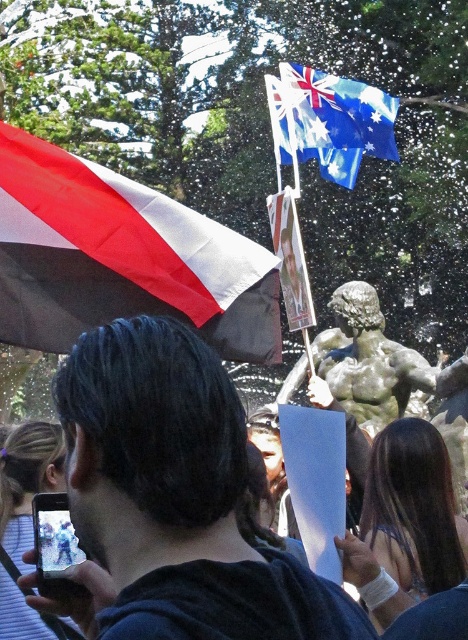
You are standing at the camera position and want to reach the point marked at coordinates (221, 252). If you walk straight ahead, will you reach that point before walking 50 meters?

Yes, because the point at (221, 252) is only 49.25 meters away from the camera, which is less than 50 meters.

You are at an event and want to take a photo of both the red and white striped flag at upper left and the blue fabric flag at upper center. Which flag should you position first in your camera frame to ensure both are visible?

You should position the red and white striped flag at upper left first in your camera frame since it is to the left of the blue fabric flag at upper center, ensuring both can be captured together.

You are at an event and want to take a photo of both the dark blue fabric at center and the red and white striped flag at upper left. Which one should you focus on first to ensure both are in the frame?

You should focus on the red and white striped flag at upper left first because the dark blue fabric at center is to the right of it, so by starting with the flag on the left, you can adjust the frame to include both objects.